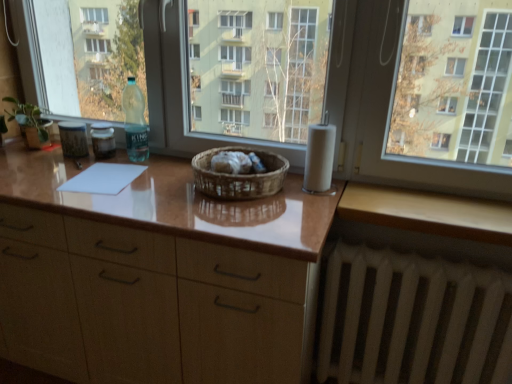
Question: Considering the positions of matte brown countertop at center and white matte toilet paper at right in the image, is matte brown countertop at center bigger or smaller than white matte toilet paper at right?

Choices:
 (A) small
 (B) big

Answer: (B)

Question: Choose the correct answer: Is matte brown countertop at center inside white matte toilet paper at right or outside it?

Choices:
 (A) inside
 (B) outside

Answer: (B)

Question: Which object is positioned closest to the transparent glass window at center?

Choices:
 (A) woven brown basket at center
 (B) white matte toilet paper at right
 (C) translucent plastic bottle at left
 (D) white matte radiator at lower right
 (E) wooden at lower right

Answer: (E)

Question: Considering the real-world distances, which object is closest to the transparent glass window at center?

Choices:
 (A) white matte toilet paper at right
 (B) green matte plant at left
 (C) white matte radiator at lower right
 (D) translucent plastic bottle at left
 (E) matte brown countertop at center

Answer: (A)